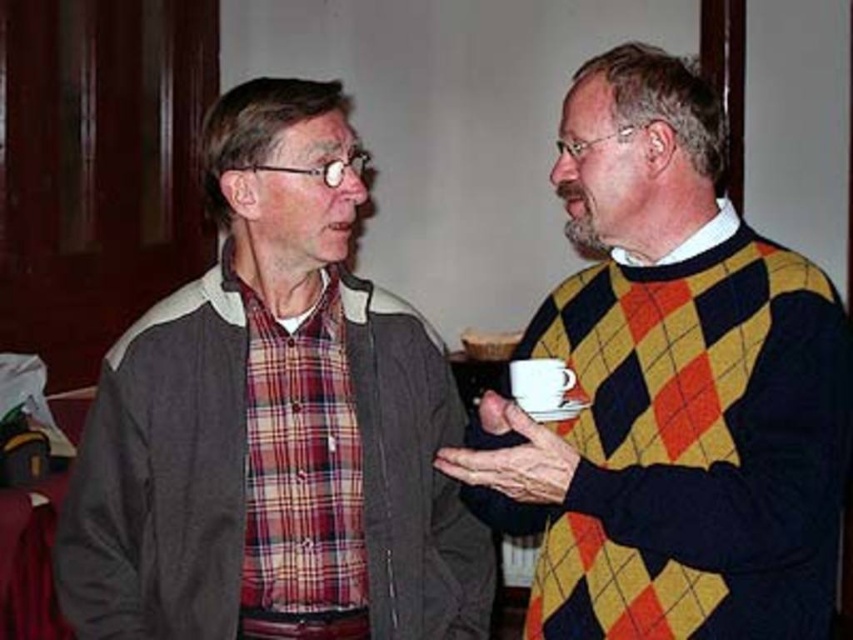
Does plaid fabric shirt at center have a larger size compared to yellow argyle sweater at right?

Incorrect, plaid fabric shirt at center is not larger than yellow argyle sweater at right.

You are a GUI agent. You are given a task and a screenshot of the screen. Output one action in this format:
    pyautogui.click(x=<x>, y=<y>)
    Task: Click on the plaid fabric shirt at center
    
    Given the screenshot: What is the action you would take?
    pyautogui.click(x=274, y=422)